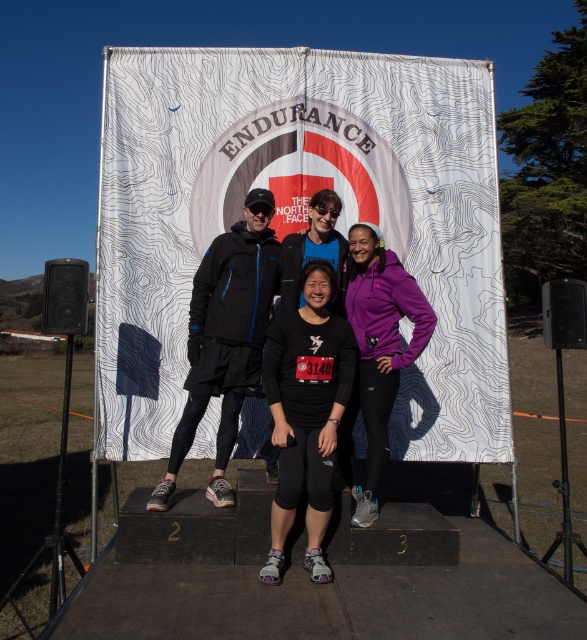
Question: Does black matte running outfit at center have a smaller size compared to purple fleece jacket at center?

Choices:
 (A) no
 (B) yes

Answer: (B)

Question: Observing the image, what is the correct spatial positioning of black matte running outfit at center in reference to purple fleece jacket at center?

Choices:
 (A) right
 (B) left

Answer: (B)

Question: Where is black matte running outfit at center located in relation to purple fleece jacket at center in the image?

Choices:
 (A) below
 (B) above

Answer: (A)

Question: Which point is farther to the camera?

Choices:
 (A) purple fleece jacket at center
 (B) black matte running outfit at center

Answer: (A)

Question: Among these points, which one is farthest from the camera?

Choices:
 (A) (353, 289)
 (B) (313, 540)

Answer: (A)